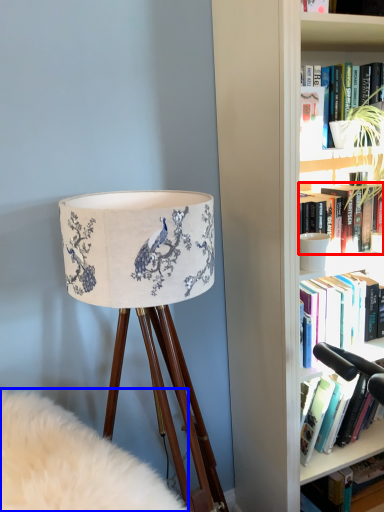
Question: Which object appears closest to the camera in this image, book (highlighted by a red box) or plain (highlighted by a blue box)?

Choices:
 (A) book
 (B) plain

Answer: (B)